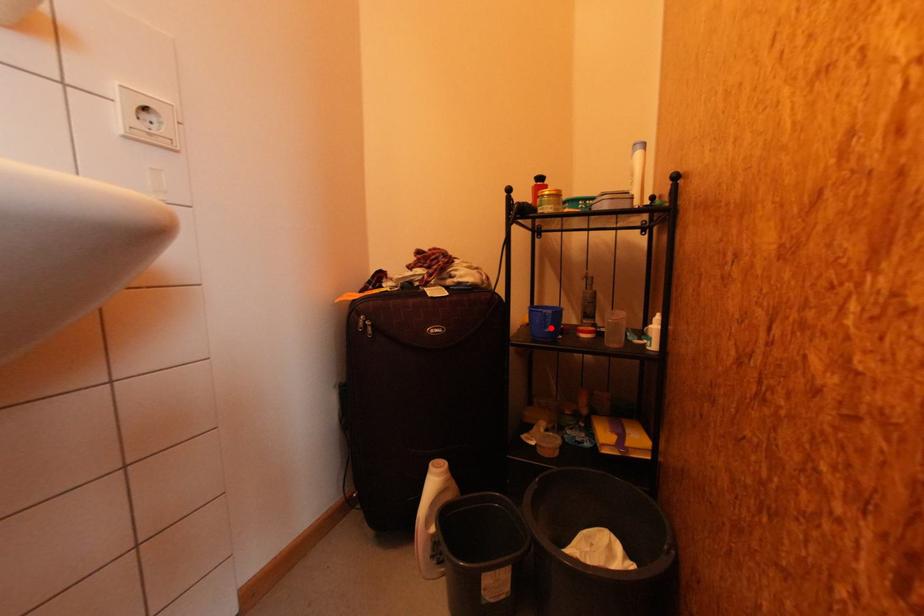
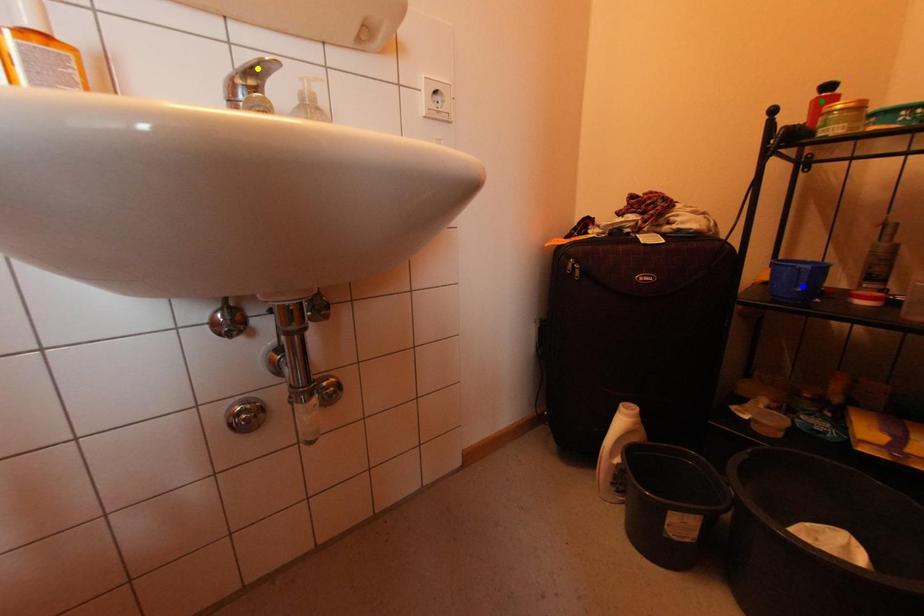
Question: I am providing you with two images of the same scene from different viewpoints. A red point is marked on the first image. You are given multiple points on the second image. Which point in image 2 is actually the same real-world point as the red point in image 1?

Choices:
 (A) blue point
 (B) green point
 (C) yellow point

Answer: (A)